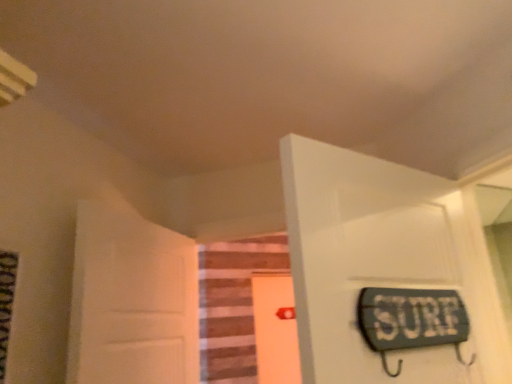
Question: Is white glossy door at upper right, the 3th door in the left-to-right sequence, shorter than white matte door at left, arranged as the 1th door when viewed from the left?

Choices:
 (A) no
 (B) yes

Answer: (B)

Question: Is white glossy door at upper right, which is counted as the 1th door, starting from the front, positioned beyond the bounds of white matte door at left, which is the third door from right to left?

Choices:
 (A) yes
 (B) no

Answer: (A)

Question: Is white glossy door at upper right, the first door positioned from the right, placed right next to white matte door at left, which is the third door from right to left?

Choices:
 (A) no
 (B) yes

Answer: (A)

Question: Can you confirm if white glossy door at upper right, which is the 3th door from back to front, is thinner than white matte door at left, which is the third door from right to left?

Choices:
 (A) yes
 (B) no

Answer: (A)

Question: From a real-world perspective, does white glossy door at upper right, the first door positioned from the right, stand above white matte door at left, arranged as the 1th door when viewed from the left?

Choices:
 (A) yes
 (B) no

Answer: (A)

Question: Would you say white glossy door at upper right, the 3th door in the left-to-right sequence, is to the left or to the right of white matte door at left, arranged as the 1th door when viewed from the left, in the picture?

Choices:
 (A) left
 (B) right

Answer: (B)

Question: Is white glossy door at upper right, the first door positioned from the right, wider or thinner than white matte door at left, the 2th door viewed from the front?

Choices:
 (A) thin
 (B) wide

Answer: (A)

Question: From a real-world perspective, is white glossy door at upper right, the first door positioned from the right, above or below white matte door at left, arranged as the 1th door when viewed from the left?

Choices:
 (A) below
 (B) above

Answer: (B)

Question: In terms of height, does white glossy door at upper right, which is counted as the 1th door, starting from the front, look taller or shorter compared to white matte door at left, the second door viewed from the back?

Choices:
 (A) short
 (B) tall

Answer: (A)

Question: Considering the positions of orange matte door at center, placed as the second door when sorted from right to left, and white matte door at left, the second door viewed from the back, in the image, is orange matte door at center, placed as the second door when sorted from right to left, bigger or smaller than white matte door at left, the second door viewed from the back,?

Choices:
 (A) big
 (B) small

Answer: (B)

Question: Is orange matte door at center, acting as the first door starting from the back, taller or shorter than white matte door at left, which is the third door from right to left?

Choices:
 (A) short
 (B) tall

Answer: (B)

Question: Is orange matte door at center, placed as the second door when sorted from right to left, in front of or behind white matte door at left, which is the third door from right to left, in the image?

Choices:
 (A) front
 (B) behind

Answer: (B)

Question: Is orange matte door at center, the 3th door viewed from the front, wider or thinner than white matte door at left, the second door viewed from the back?

Choices:
 (A) wide
 (B) thin

Answer: (B)

Question: In the image, is wooden stairs at center positioned in front of or behind orange matte door at center, arranged as the 2th door when viewed from the left?

Choices:
 (A) behind
 (B) front

Answer: (B)

Question: From the image's perspective, is wooden stairs at center above or below orange matte door at center, acting as the first door starting from the back?

Choices:
 (A) above
 (B) below

Answer: (A)